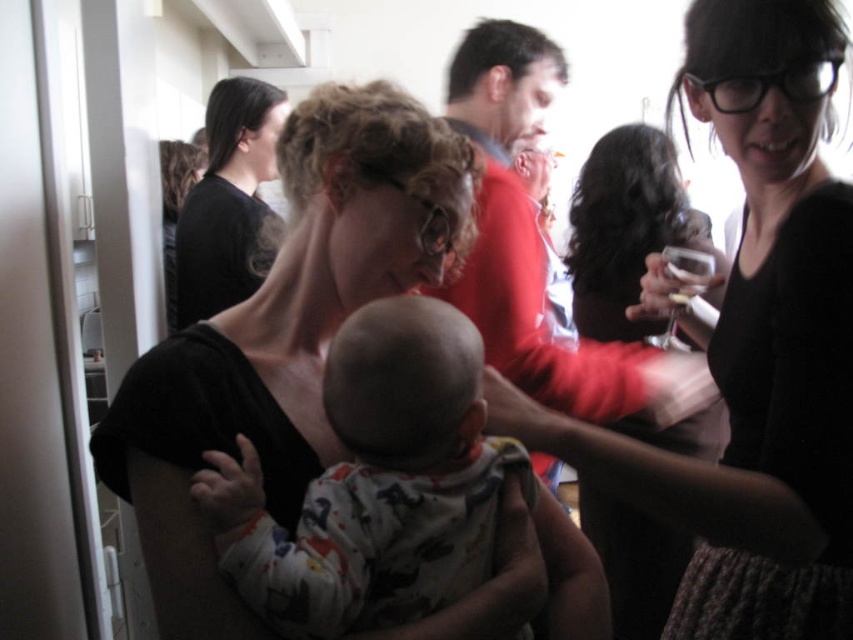
You are standing in the room and want to take a photo of both the point at coordinates point (x=799, y=403) and the point at coordinates point (x=625, y=172). Which point should you focus on first to ensure both are in focus?

You should focus on point (x=799, y=403) first because it is closer to the camera than point (x=625, y=172). This way, the depth of field will likely cover both points when focusing on the closer one.

You are standing in the room and want to reach the point marked as point (x=740, y=264). If you take a step forward of 1 meter, will you be able to reach that point?

The distance between you and point (x=740, y=264) is 98.24 centimeters. Since you are taking a step forward of 1 meter, which is 100 centimeters, you will surpass the point by approximately 1.76 centimeters.